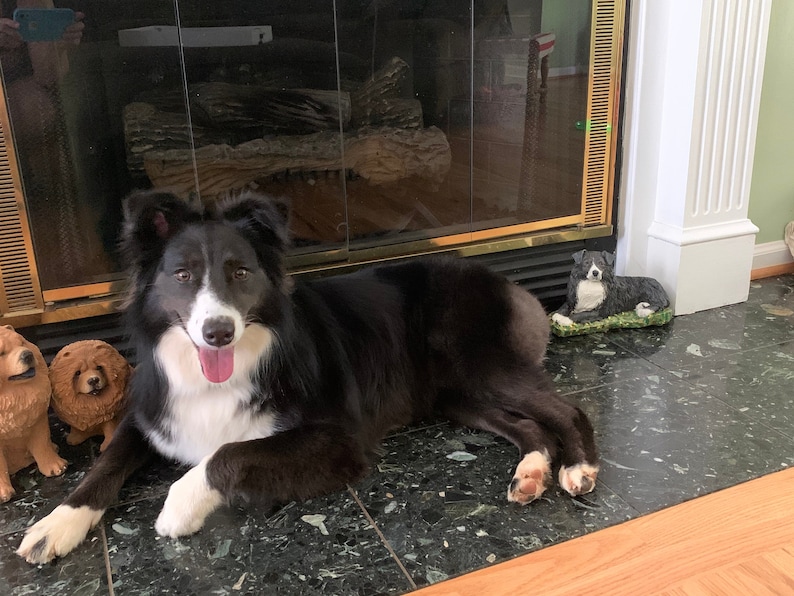
At what (x,y) coordinates should I click in order to perform the action: click on ceramic dog statues. Please return your answer as a coordinate pair (x, y). Looking at the image, I should click on (613, 291), (17, 390), (75, 369).